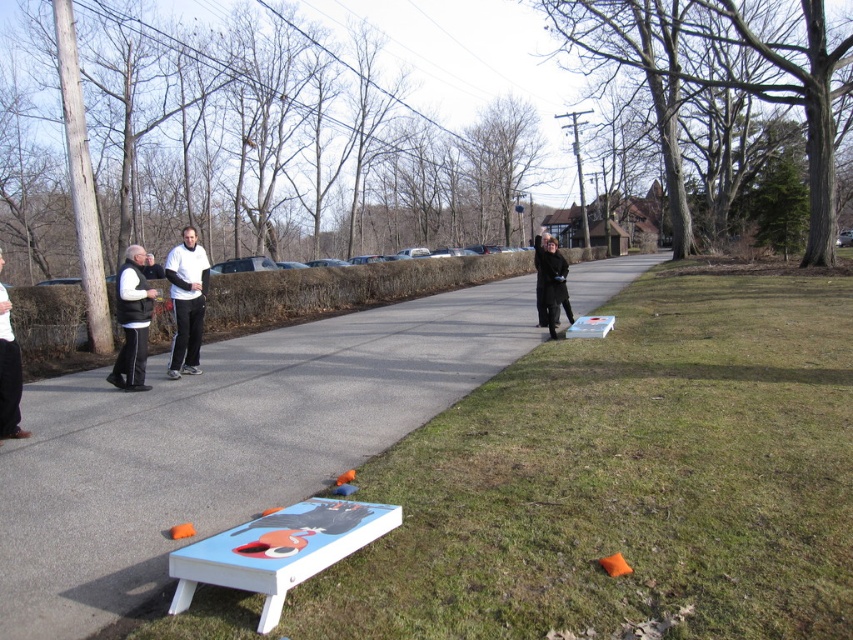
Measure the distance from white matte vest at left to black matte jacket at center.

The distance of white matte vest at left from black matte jacket at center is 8.31 meters.

Between point (13, 390) and point (555, 298), which one is positioned behind?

The point (555, 298) is behind.

The width and height of the screenshot is (853, 640). Find the location of `white matte vest at left`. white matte vest at left is located at coordinates (9, 374).

Is white painted pavement at lower center shorter than black matte jacket at center?

No, white painted pavement at lower center is not shorter than black matte jacket at center.

Which is more to the left, white painted pavement at lower center or black matte jacket at center?

From the viewer's perspective, white painted pavement at lower center appears more on the left side.

Which is behind, point (331, 406) or point (564, 291)?

Positioned behind is point (564, 291).

Locate an element on the screen. white painted pavement at lower center is located at coordinates (223, 444).

Does white painted pavement at lower center have a greater width compared to white matte tracksuit at center?

Yes, white painted pavement at lower center is wider than white matte tracksuit at center.

Is white painted pavement at lower center to the right of white matte tracksuit at center from the viewer's perspective?

Correct, you'll find white painted pavement at lower center to the right of white matte tracksuit at center.

Describe the element at coordinates (223, 444) in the screenshot. The image size is (853, 640). I see `white painted pavement at lower center` at that location.

Where is `white painted pavement at lower center`? The width and height of the screenshot is (853, 640). white painted pavement at lower center is located at coordinates (223, 444).